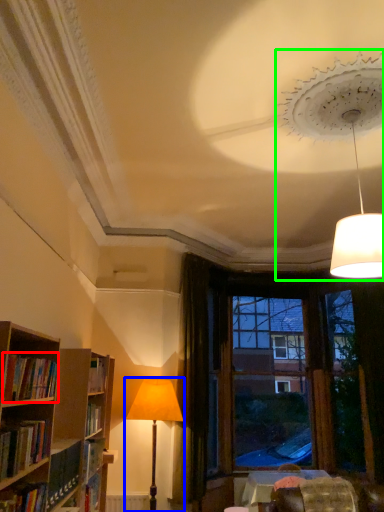
Question: Which object is the farthest from book (highlighted by a red box)? Choose among these: lamp (highlighted by a blue box) or lamp (highlighted by a green box).

Choices:
 (A) lamp
 (B) lamp

Answer: (B)